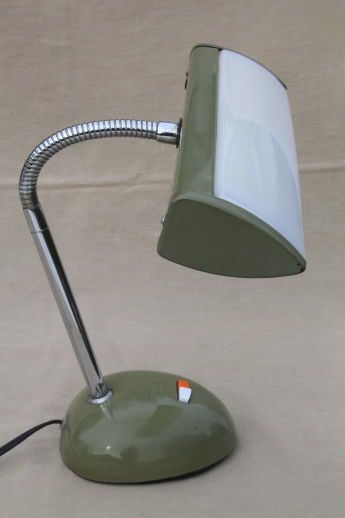
You are a GUI agent. You are given a task and a screenshot of the screen. Output one action in this format:
    pyautogui.click(x=<x>, y=<y>)
    Task: Click on the black cord
    
    Given the screenshot: What is the action you would take?
    pyautogui.click(x=31, y=431)